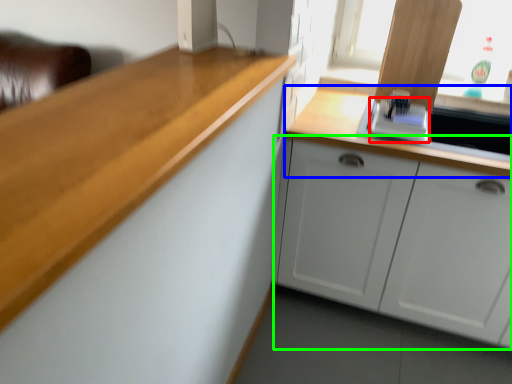
Question: Which object is the closest to the appliance (highlighted by a red box)? Choose among these: countertop (highlighted by a blue box) or cabinetry (highlighted by a green box).

Choices:
 (A) countertop
 (B) cabinetry

Answer: (A)